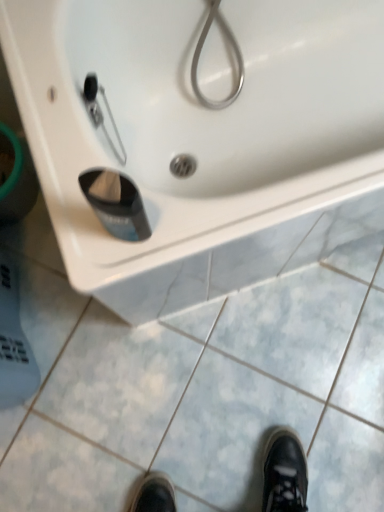
Question: Is white glossy sink at upper center oriented towards white glossy sink at upper center?

Choices:
 (A) yes
 (B) no

Answer: (A)

Question: Can you confirm if white glossy sink at upper center is smaller than white glossy sink at upper center?

Choices:
 (A) no
 (B) yes

Answer: (A)

Question: From the image's perspective, does white glossy sink at upper center appear lower than white glossy sink at upper center?

Choices:
 (A) no
 (B) yes

Answer: (A)

Question: Is white glossy sink at upper center outside of white glossy sink at upper center?

Choices:
 (A) yes
 (B) no

Answer: (A)

Question: Is white glossy sink at upper center shorter than white glossy sink at upper center?

Choices:
 (A) yes
 (B) no

Answer: (B)

Question: Is white glossy sink at upper center closer to the viewer compared to white glossy sink at upper center?

Choices:
 (A) yes
 (B) no

Answer: (A)

Question: Does white glossy sink at upper center come in front of black plastic cup at lower center?

Choices:
 (A) no
 (B) yes

Answer: (A)

Question: From a real-world perspective, is white glossy sink at upper center physically above black plastic cup at lower center?

Choices:
 (A) yes
 (B) no

Answer: (B)

Question: From the image's perspective, is white glossy sink at upper center below black plastic cup at lower center?

Choices:
 (A) yes
 (B) no

Answer: (B)

Question: Would you say white glossy sink at upper center is a long distance from black plastic cup at lower center?

Choices:
 (A) no
 (B) yes

Answer: (A)

Question: Can you confirm if white glossy sink at upper center is shorter than black plastic cup at lower center?

Choices:
 (A) no
 (B) yes

Answer: (A)

Question: Is white glossy sink at upper center beside black plastic cup at lower center?

Choices:
 (A) yes
 (B) no

Answer: (B)

Question: Is black plastic cup at lower center outside of white glossy sink at upper center?

Choices:
 (A) yes
 (B) no

Answer: (A)